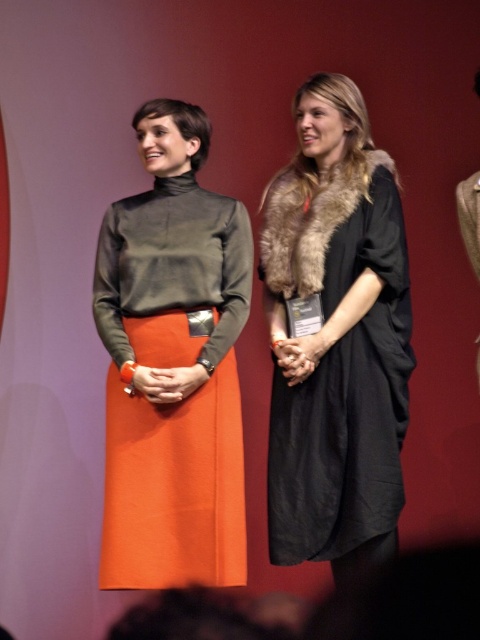
Who is more forward, (207, 120) or (333, 429)?

Positioned in front is point (333, 429).

Does point (229, 480) come behind point (396, 499)?

That is True.

Which is in front, point (204, 141) or point (406, 305)?

Positioned in front is point (406, 305).

Find the location of `orange matte skirt at center`. orange matte skirt at center is located at coordinates pyautogui.click(x=172, y=365).